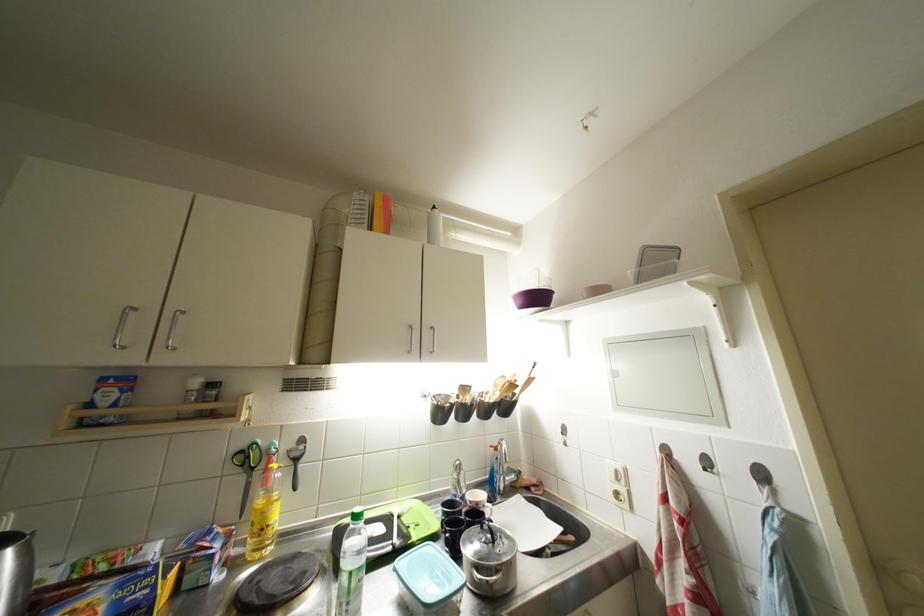
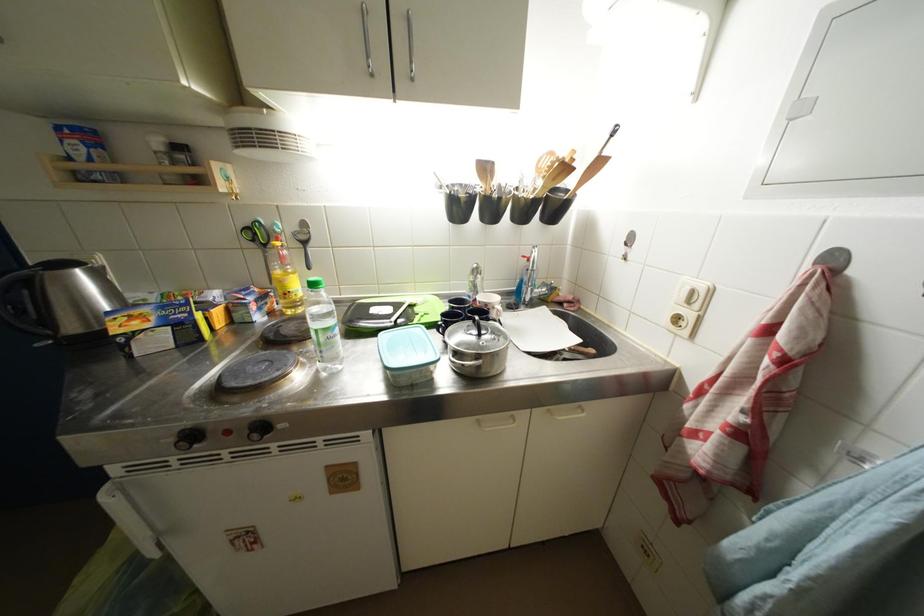
Where in the second image is the point corresponding to [515,386] from the first image?

(565, 164)